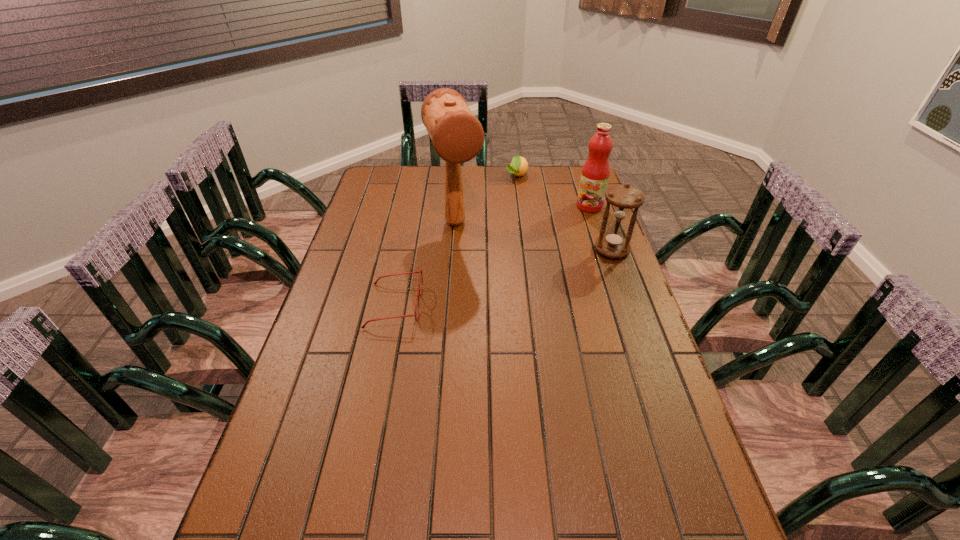
Identify the location of hourglass that is at the right edge. (614, 244).

Where is `fruit juice that is at the right edge`? The image size is (960, 540). fruit juice that is at the right edge is located at coordinates (595, 174).

You are a GUI agent. You are given a task and a screenshot of the screen. Output one action in this format:
    pyautogui.click(x=<x>, y=<y>)
    Task: Click on the vacant space at the far edge of the desktop
    
    Given the screenshot: What is the action you would take?
    pyautogui.click(x=504, y=179)

Identify the location of free space at the near edge of the desktop. The height and width of the screenshot is (540, 960). (478, 524).

This screenshot has width=960, height=540. In the image, there is a desktop. What are the coordinates of `blank space at the left edge` in the screenshot? It's located at (361, 214).

Image resolution: width=960 pixels, height=540 pixels. I want to click on free spot at the right edge of the desktop, so click(x=591, y=295).

At what (x,y) coordinates should I click in order to perform the action: click on vacant area at the far left corner of the desktop. Please return your answer as a coordinate pair (x, y). Image resolution: width=960 pixels, height=540 pixels. Looking at the image, I should click on (377, 194).

Where is `vacant point at the near left corner`? The image size is (960, 540). vacant point at the near left corner is located at coordinates (282, 511).

This screenshot has width=960, height=540. What are the coordinates of `free location at the far right corner of the desktop` in the screenshot? It's located at click(574, 192).

You are a GUI agent. You are given a task and a screenshot of the screen. Output one action in this format:
    pyautogui.click(x=<x>, y=<y>)
    Task: Click on the free space between the fruit juice and the shortest object
    
    Given the screenshot: What is the action you would take?
    pyautogui.click(x=492, y=255)